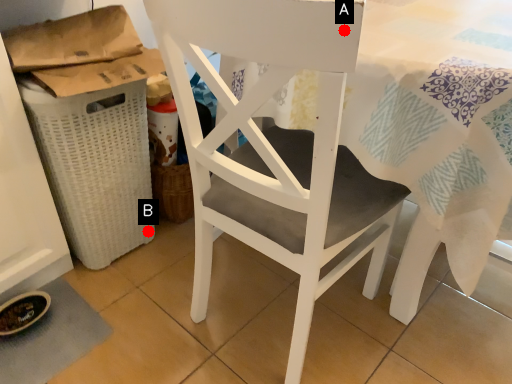
Question: Two points are circled on the image, labeled by A and B beside each circle. Which point is closer to the camera?

Choices:
 (A) A is closer
 (B) B is closer

Answer: (A)